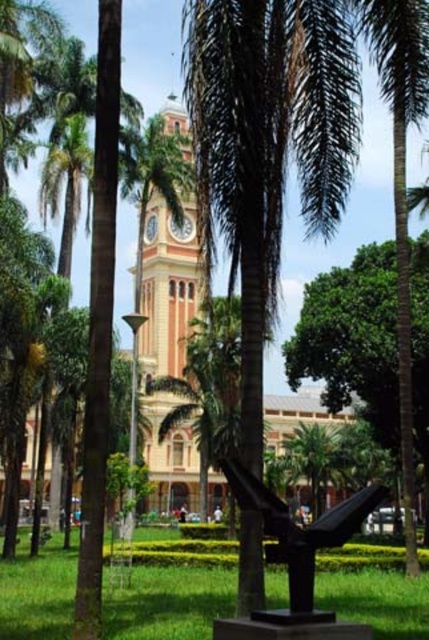
Is yellow brick clock tower at center smaller than black polished sculpture at center?

No.

Image resolution: width=429 pixels, height=640 pixels. Identify the location of yellow brick clock tower at center. (166, 257).

What are the coordinates of `yellow brick clock tower at center` in the screenshot? It's located at (166, 257).

At what (x,y) coordinates should I click in order to perform the action: click on yellow brick clock tower at center. Please return your answer as a coordinate pair (x, y). The width and height of the screenshot is (429, 640). Looking at the image, I should click on 166,257.

Is point (2, 563) positioned before point (169, 118)?

Yes, point (2, 563) is in front of point (169, 118).

Who is positioned more to the left, green grass at center or yellow brick clock tower at center?

Positioned to the left is yellow brick clock tower at center.

Is point (151, 573) in front of point (169, 326)?

Yes, point (151, 573) is closer to viewer.

I want to click on green grass at center, so click(x=168, y=602).

Who is more forward, (147,628) or (277,531)?

Point (277,531) is more forward.

Is green grass at center above black polished sculpture at center?

No.

Based on the photo, who is more forward, [395,592] or [293,524]?

Point [293,524] is more forward.

The width and height of the screenshot is (429, 640). I want to click on green grass at center, so click(x=168, y=602).